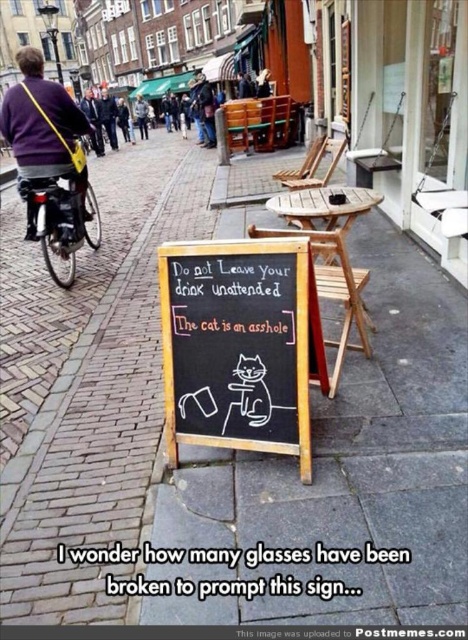
You are standing at the point with coordinates point (146,106) and want to walk to the point with coordinates point (277,291). Which direction should you face to walk towards your destination?

You should face forward because point (277,291) is in front of point (146,106).

You are a street artist planning to place a new poster on the black chalkboard at center. The poster is as wide as the dark blue sweater at upper left. Will the poster fit on the chalkboard without overlapping the edges?

The black chalkboard at center has a width less than the dark blue sweater at upper left. Since the poster is as wide as the dark blue sweater at upper left, it will not fit on the black chalkboard at center without overlapping the edges.

You are a tourist standing on the sidewalk looking at the black chalkboard at center and the dark blue sweater at upper left. Which object is closer to the street?

The dark blue sweater at upper left is closer to the street because it is positioned to the left of the black chalkboard at center, which is further away from the street.